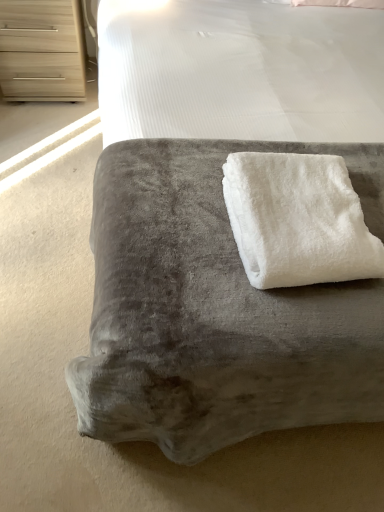
This screenshot has width=384, height=512. I want to click on vacant area that lies in front of light wood chest of drawers at upper left, so pos(48,126).